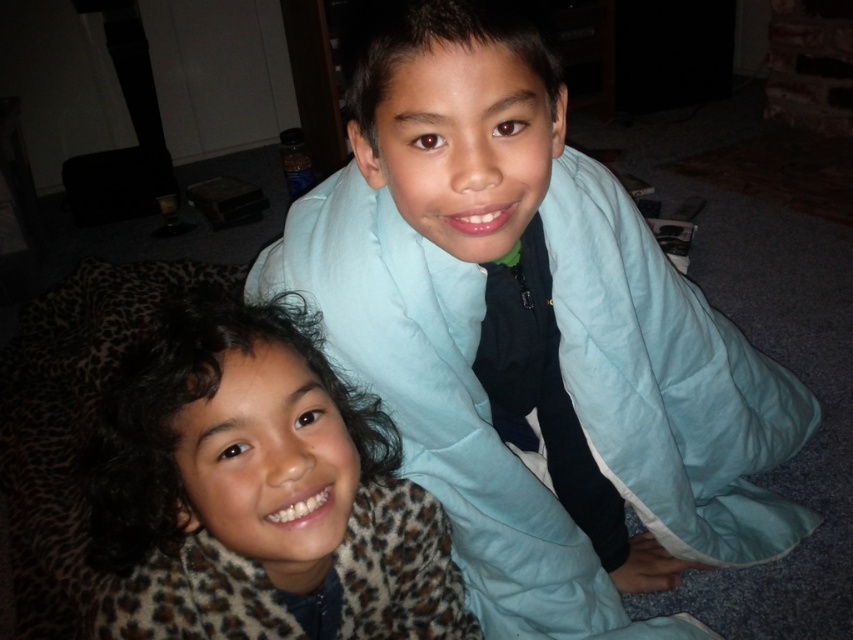
You are a photographer setting up a shoot in a cozy living room. You notice the light blue quilted blanket at upper center and the leopard print sweater at lower left. Which object would require more space to frame in your camera shot?

The light blue quilted blanket at upper center is bigger than the leopard print sweater at lower left, so it would require more space to frame in your camera shot.

You are a photographer setting up a shoot in this living room. You notice the leopard print sweater at lower left and the light blue quilted blanket at upper center. Which object is closer to the camera?

The leopard print sweater at lower left is behind the light blue quilted blanket at upper center, so the light blue quilted blanket at upper center is closer to the camera.

You are a photographer setting up a shot of the two children. The light blue quilted blanket at upper center and the leopard print sweater at lower left are in the frame. Which object is positioned higher up in the image?

The light blue quilted blanket at upper center is positioned higher up in the image as it is much taller than the leopard print sweater at lower left.